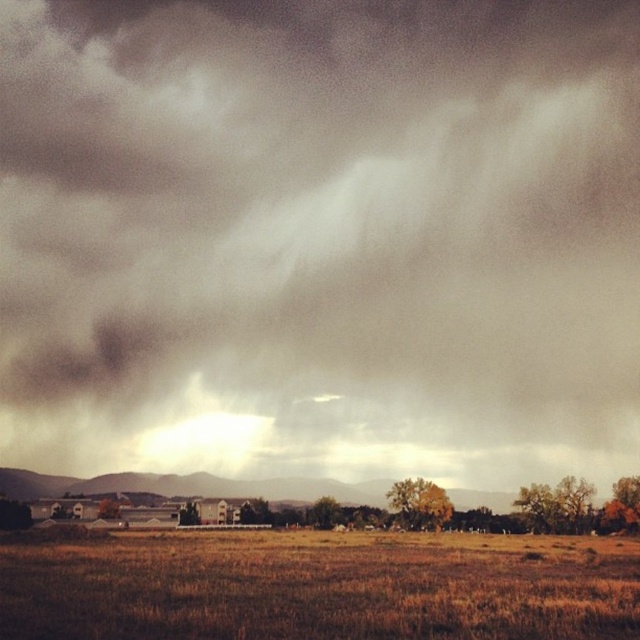
Question: Among these objects, which one is farthest from the camera?

Choices:
 (A) brown dry grass at lower center
 (B) dark gray cloud at upper center

Answer: (B)

Question: Which object appears closest to the camera in this image?

Choices:
 (A) dark gray cloud at upper center
 (B) brown dry grass at lower center

Answer: (B)

Question: Considering the relative positions of dark gray cloud at upper center and brown dry grass at lower center in the image provided, where is dark gray cloud at upper center located with respect to brown dry grass at lower center?

Choices:
 (A) above
 (B) below

Answer: (A)

Question: Can you confirm if dark gray cloud at upper center is bigger than brown dry grass at lower center?

Choices:
 (A) no
 (B) yes

Answer: (B)

Question: Is the position of dark gray cloud at upper center more distant than that of brown dry grass at lower center?

Choices:
 (A) yes
 (B) no

Answer: (A)